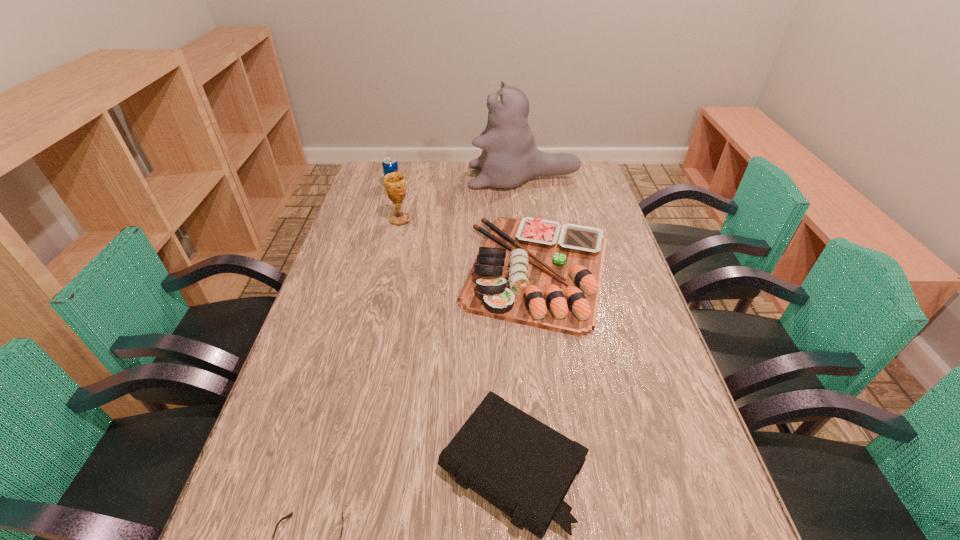
The width and height of the screenshot is (960, 540). Find the location of `cat`. cat is located at coordinates (509, 157).

Identify the location of the fifth shortest object. (395, 186).

What are the coordinates of `the fourth shortest object` in the screenshot? It's located at (390, 165).

You are a GUI agent. You are given a task and a screenshot of the screen. Output one action in this format:
    pyautogui.click(x=<x>, y=<y>)
    Task: Click on the platter
    Image resolution: width=960 pixels, height=540 pixels.
    Given the screenshot: What is the action you would take?
    pyautogui.click(x=531, y=271)

Locate an element on the screen. free spot located 0.300m on the face of the cat is located at coordinates (394, 177).

I want to click on free location located 0.220m on the face of the cat, so click(414, 177).

You are a GUI agent. You are given a task and a screenshot of the screen. Output one action in this format:
    pyautogui.click(x=<x>, y=<y>)
    Task: Click on the free spot located on the face of the cat
    This screenshot has height=540, width=960.
    Given the screenshot: What is the action you would take?
    pyautogui.click(x=420, y=177)

Locate an element on the screen. This screenshot has width=960, height=540. vacant space situated 0.050m on the back of the second tallest object is located at coordinates (403, 206).

Locate an element on the screen. The width and height of the screenshot is (960, 540). free spot located 0.230m on the right of the fourth shortest object is located at coordinates (460, 186).

The height and width of the screenshot is (540, 960). In order to click on blank area located 0.270m on the front of the platter in this screenshot , I will do `click(562, 434)`.